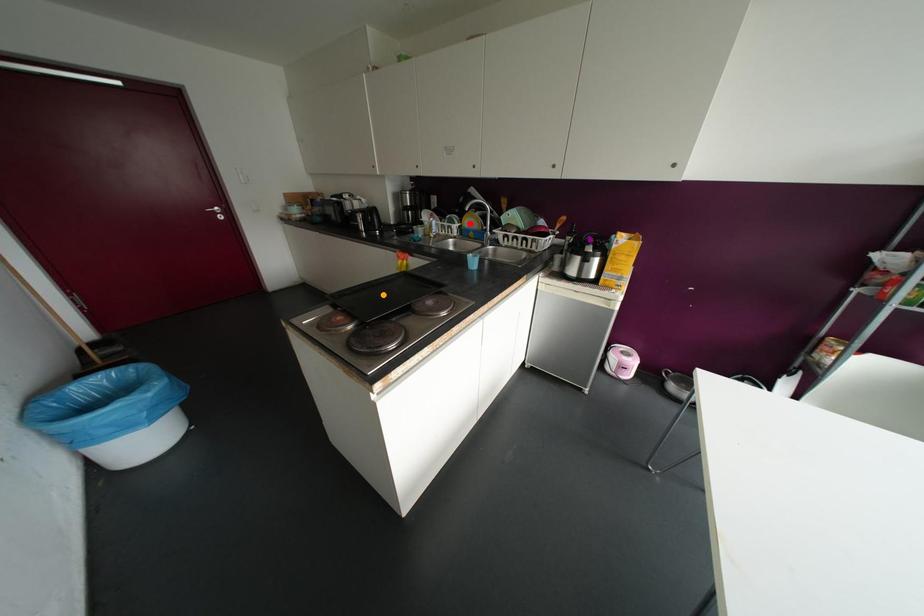
Order these from nearest to farthest:
1. purple point
2. red point
3. orange point

orange point
purple point
red point